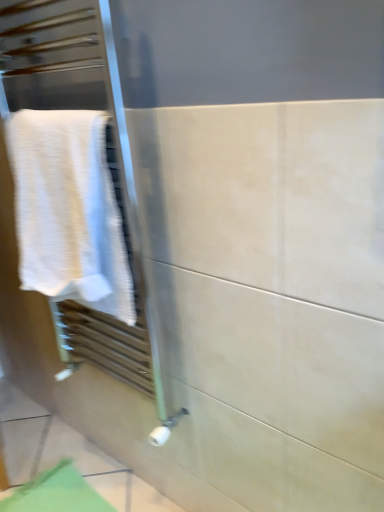
The width and height of the screenshot is (384, 512). What do you see at coordinates (69, 210) in the screenshot?
I see `white textured towel at left` at bounding box center [69, 210].

I want to click on white textured towel at left, so click(x=69, y=210).

Where is `white textured towel at left`? This screenshot has width=384, height=512. white textured towel at left is located at coordinates coord(69,210).